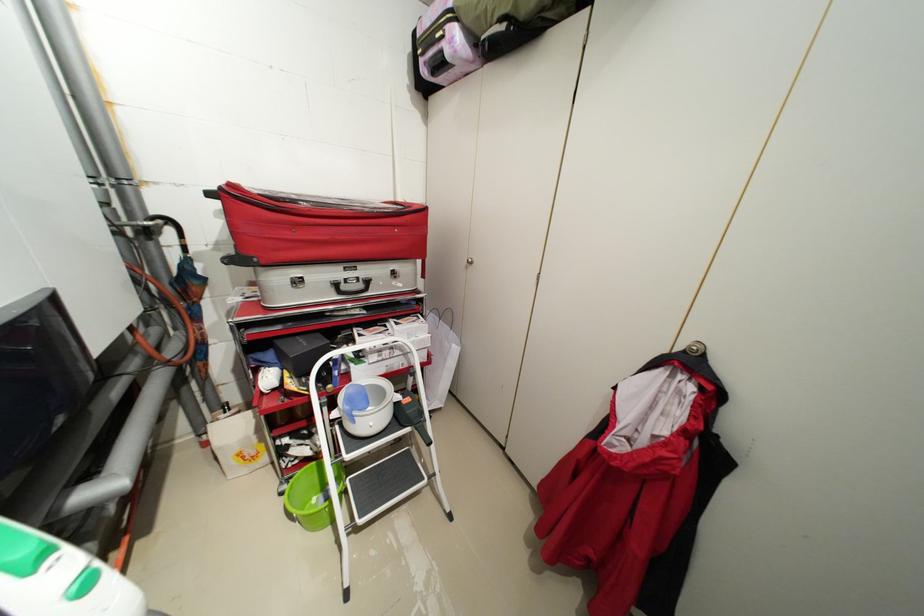
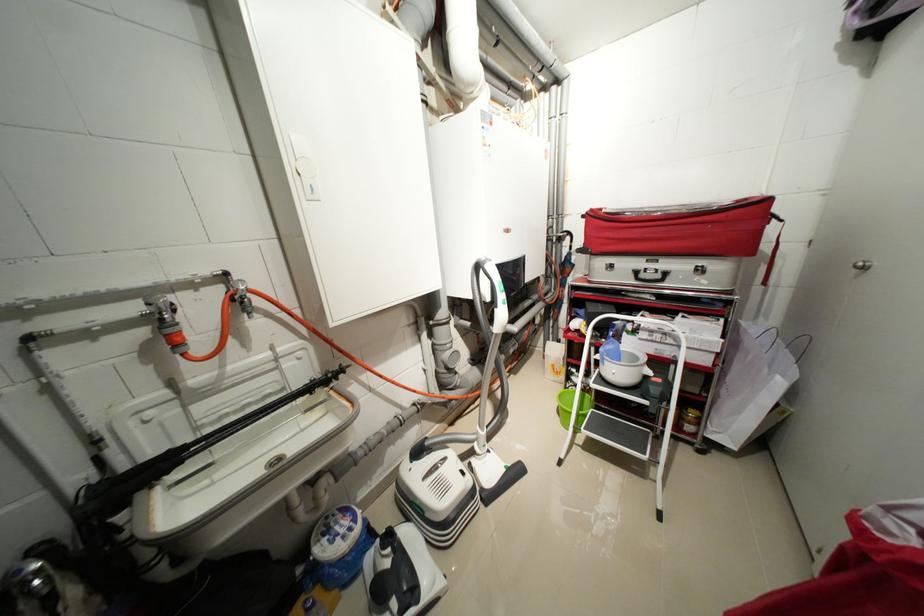
Find the pixel in the second image that matches point (237, 185) in the first image.

(599, 211)